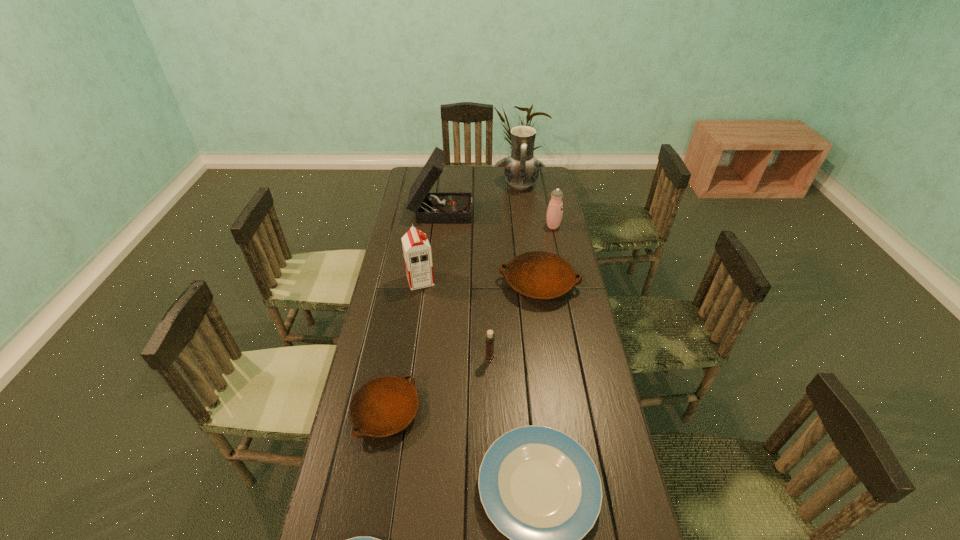
Where is `unoccupied position between the farthest object and the right brown plate`? This screenshot has width=960, height=540. unoccupied position between the farthest object and the right brown plate is located at coordinates (530, 234).

Where is `free spot between the soya milk and the phonograph_record`? The height and width of the screenshot is (540, 960). free spot between the soya milk and the phonograph_record is located at coordinates (431, 245).

Find the location of a particular element. Image resolution: width=960 pixels, height=540 pixels. vacant area that lies between the third tallest object and the thermos bottle is located at coordinates (487, 253).

Locate an element on the screen. free space between the phonograph_record and the right brown plate is located at coordinates tap(490, 247).

Where is `vacant point located between the pitcher and the phonograph_record`? vacant point located between the pitcher and the phonograph_record is located at coordinates (481, 198).

Identify the location of free space that is in between the fifth tallest object and the bigger brown plate. The height and width of the screenshot is (540, 960). (515, 321).

Locate an element on the screen. The height and width of the screenshot is (540, 960). unoccupied position between the phonograph_record and the fifth shortest object is located at coordinates (466, 284).

Locate which object ranks fifth in proximity to the right brown plate. Please provide its 2D coordinates. Your answer should be formatted as a tuple, i.e. [(x, y)], where the tuple contains the x and y coordinates of a point satisfying the conditions above.

[(383, 406)]

At what (x,y) coordinates should I click in order to perform the action: click on object that is the sixth closest to the eighth tallest object. Please return your answer as a coordinate pair (x, y). This screenshot has width=960, height=540. Looking at the image, I should click on (555, 208).

Find the location of `plate that is the closest to the fourth shortest object`. plate that is the closest to the fourth shortest object is located at coordinates (383, 406).